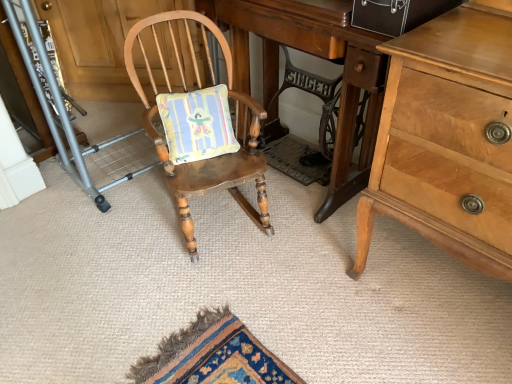
Question: From a real-world perspective, is wooden rocking chair at center on wooden desk at center?

Choices:
 (A) yes
 (B) no

Answer: (B)

Question: Is wooden rocking chair at center bigger than wooden desk at center?

Choices:
 (A) yes
 (B) no

Answer: (B)

Question: From a real-world perspective, is wooden rocking chair at center under wooden desk at center?

Choices:
 (A) yes
 (B) no

Answer: (A)

Question: Does wooden rocking chair at center lie in front of wooden desk at center?

Choices:
 (A) no
 (B) yes

Answer: (B)

Question: Is wooden rocking chair at center looking in the opposite direction of wooden desk at center?

Choices:
 (A) yes
 (B) no

Answer: (B)

Question: Is light brown wooden chest of drawers at right in front of or behind brushed metal folding chair at left in the image?

Choices:
 (A) behind
 (B) front

Answer: (B)

Question: From a real-world perspective, is light brown wooden chest of drawers at right above or below brushed metal folding chair at left?

Choices:
 (A) above
 (B) below

Answer: (A)

Question: Do you think light brown wooden chest of drawers at right is within brushed metal folding chair at left, or outside of it?

Choices:
 (A) inside
 (B) outside

Answer: (B)

Question: Is point (467, 153) closer or farther from the camera than point (7, 109)?

Choices:
 (A) closer
 (B) farther

Answer: (A)

Question: From the image's perspective, is brushed metal folding chair at left above or below light brown wooden chest of drawers at right?

Choices:
 (A) below
 (B) above

Answer: (B)

Question: Would you say brushed metal folding chair at left is inside or outside light brown wooden chest of drawers at right?

Choices:
 (A) inside
 (B) outside

Answer: (B)

Question: From a real-world perspective, is brushed metal folding chair at left above or below light brown wooden chest of drawers at right?

Choices:
 (A) above
 (B) below

Answer: (B)

Question: Considering the positions of point (6, 87) and point (386, 182), is point (6, 87) closer or farther from the camera than point (386, 182)?

Choices:
 (A) closer
 (B) farther

Answer: (B)

Question: Considering the positions of point (206, 54) and point (380, 94), is point (206, 54) closer or farther from the camera than point (380, 94)?

Choices:
 (A) farther
 (B) closer

Answer: (A)

Question: Is wooden rocking chair at center taller or shorter than wooden desk at center?

Choices:
 (A) short
 (B) tall

Answer: (A)